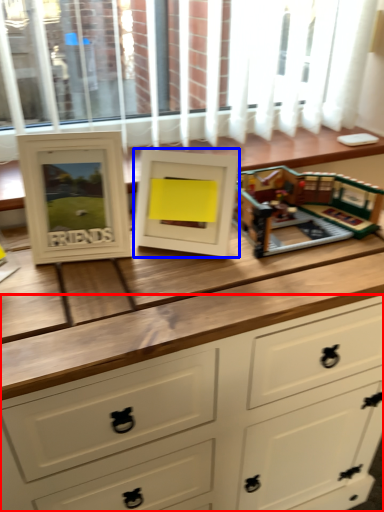
Question: Which object is further to the camera taking this photo, chest of drawers (highlighted by a red box) or picture frame (highlighted by a blue box)?

Choices:
 (A) chest of drawers
 (B) picture frame

Answer: (B)